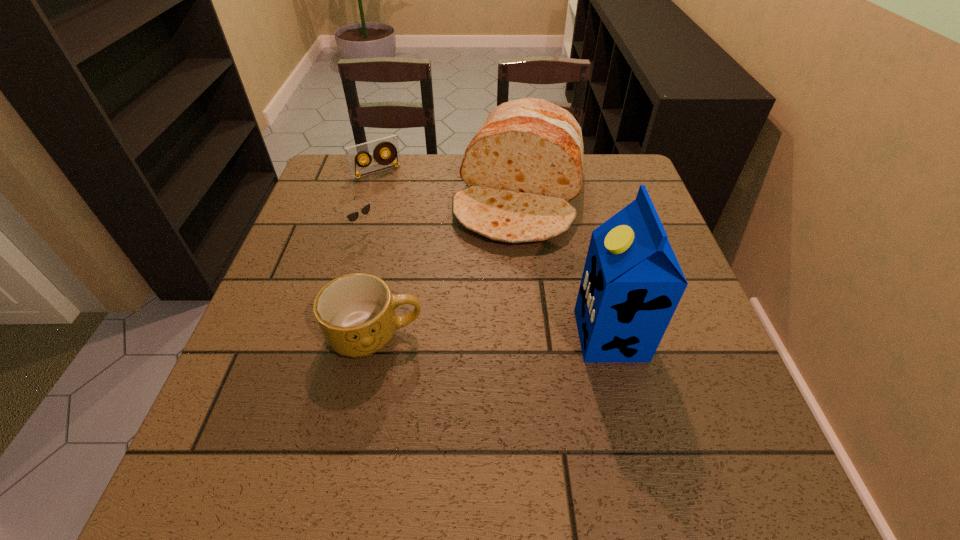
The height and width of the screenshot is (540, 960). Find the location of `free region at the right edge`. free region at the right edge is located at coordinates (659, 360).

This screenshot has width=960, height=540. Identify the location of free space at the far left corner of the desktop. (340, 159).

The image size is (960, 540). Identify the location of vacant space at the far right corner of the desktop. (588, 158).

In the image, there is a desktop. Identify the location of vacant region at the near right corner. The width and height of the screenshot is (960, 540). pyautogui.click(x=703, y=407).

This screenshot has height=540, width=960. What are the coordinates of `blank region between the tallest object and the mug` in the screenshot? It's located at (492, 335).

Locate an element on the screen. free spot between the videotape and the second tallest object is located at coordinates (448, 184).

Where is `vacant area between the mug and the bread`? This screenshot has width=960, height=540. vacant area between the mug and the bread is located at coordinates (448, 266).

Locate an element on the screen. The height and width of the screenshot is (540, 960). free space between the videotape and the shortest object is located at coordinates (370, 201).

At what (x,y) coordinates should I click in order to perform the action: click on free spot between the tallest object and the mug. Please return your answer as a coordinate pair (x, y). Image resolution: width=960 pixels, height=540 pixels. Looking at the image, I should click on (492, 335).

Where is `vacant area that lies between the carton and the videotape`? The width and height of the screenshot is (960, 540). vacant area that lies between the carton and the videotape is located at coordinates (493, 254).